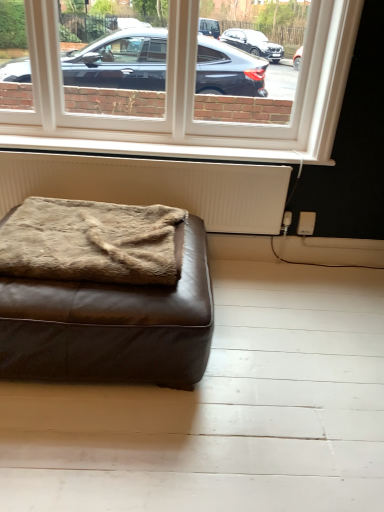
Question: In the image, is brown fuzzy blanket at lower left on the left side or the right side of brown leather ottoman at lower left?

Choices:
 (A) right
 (B) left

Answer: (A)

Question: Does point (112, 220) appear closer or farther from the camera than point (97, 339)?

Choices:
 (A) farther
 (B) closer

Answer: (A)

Question: Estimate the real-world distances between objects in this image. Which object is closer to the white painted wood at lower center?

Choices:
 (A) white plastic window at upper center
 (B) brown fuzzy blanket at lower left
 (C) white textured radiator at lower center
 (D) brown leather ottoman at lower left

Answer: (C)

Question: Which object is positioned farthest from the white painted wood at lower center?

Choices:
 (A) brown leather ottoman at lower left
 (B) brown fuzzy blanket at lower left
 (C) white plastic window at upper center
 (D) white textured radiator at lower center

Answer: (A)